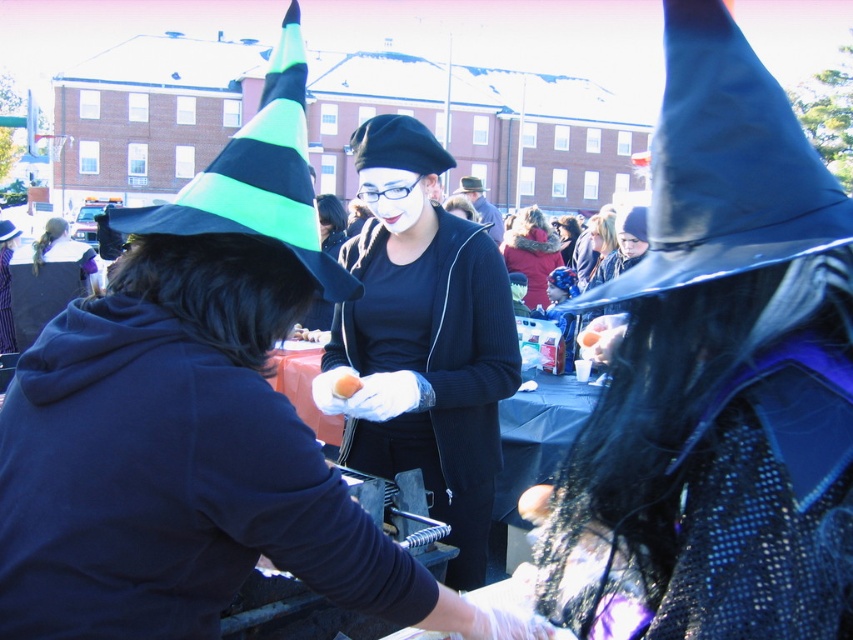
Can you confirm if matte black hoodie at center is thinner than matte black clown nose at center?

No, matte black hoodie at center is not thinner than matte black clown nose at center.

Image resolution: width=853 pixels, height=640 pixels. What do you see at coordinates (167, 488) in the screenshot? I see `matte black hoodie at center` at bounding box center [167, 488].

The height and width of the screenshot is (640, 853). Find the location of `matte black hoodie at center`. matte black hoodie at center is located at coordinates (167, 488).

Is velvet red coat at center wider than orange matte apple at center?

Correct, the width of velvet red coat at center exceeds that of orange matte apple at center.

Identify the location of velvet red coat at center. (531, 252).

Is matte black hoodie at center positioned at the back of neon green/black striped witch hat at left?

That is False.

Does point (233, 413) come farther from viewer compared to point (296, 211)?

No.

The image size is (853, 640). In order to click on matte black hoodie at center in this screenshot , I will do `click(167, 488)`.